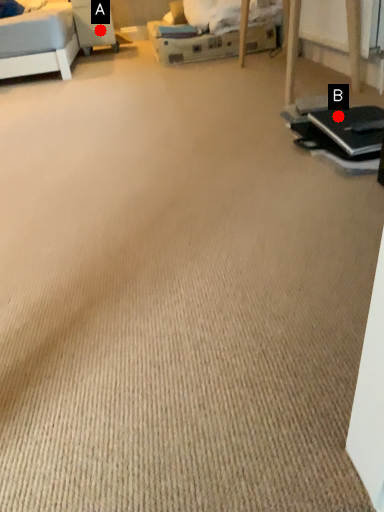
Question: Two points are circled on the image, labeled by A and B beside each circle. Which point is further to the camera?

Choices:
 (A) A is further
 (B) B is further

Answer: (A)